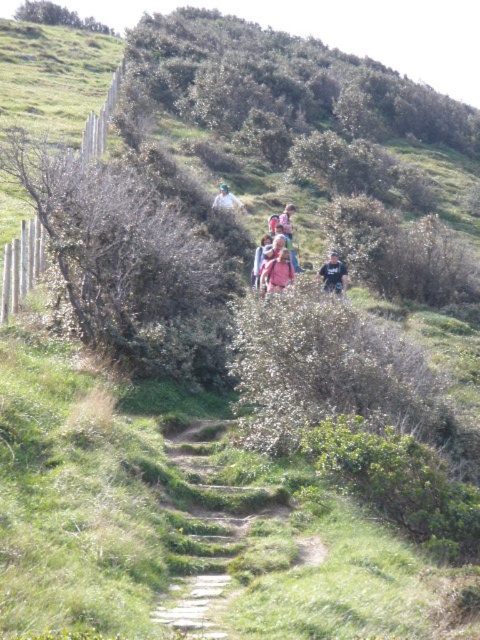
You are a hiker on the trail and see the green mossy stone steps at center and the dark blue jacket at center. Which object is positioned to the left?

The green mossy stone steps at center is to the left of dark blue jacket at center, so the green mossy stone steps at center is positioned to the left.

Based on the photo, you are a hiker standing on the green mossy stone steps at center and looking towards the matte pink shirt at center. Which object is higher in elevation?

The green mossy stone steps at center is taller than the matte pink shirt at center, so the green mossy stone steps at center is higher in elevation.

You are a hiker trying to locate the green mossy stone steps at center on the trail. According to the map coordinates, where exactly should you look for them?

The green mossy stone steps at center are located at point [195,604] on the map.